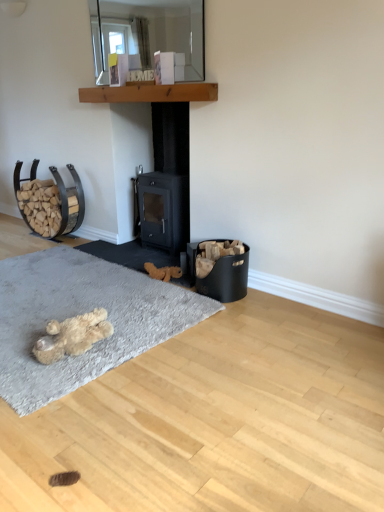
Question: Is black matte fireplace at center in front of or behind clear glass mirror at upper center in the image?

Choices:
 (A) behind
 (B) front

Answer: (A)

Question: From their relative heights in the image, would you say black matte fireplace at center is taller or shorter than clear glass mirror at upper center?

Choices:
 (A) tall
 (B) short

Answer: (A)

Question: Considering the real-world distances, which object is closest to the clear glass mirror at upper center?

Choices:
 (A) brown plush toy at center, the second animal from the bottom
 (B) black matte fireplace at center
 (C) soft gray carpet at lower left
 (D) fuzzy beige teddy bear at lower left, which is the first animal from front to back
 (E) wooden at upper center

Answer: (E)

Question: Which object is positioned farthest from the fuzzy beige teddy bear at lower left, which is counted as the first animal, starting from the bottom?

Choices:
 (A) wooden at upper center
 (B) brown plush toy at center, which appears as the 1th animal when viewed from the top
 (C) soft gray carpet at lower left
 (D) black matte fireplace at center
 (E) clear glass mirror at upper center

Answer: (E)